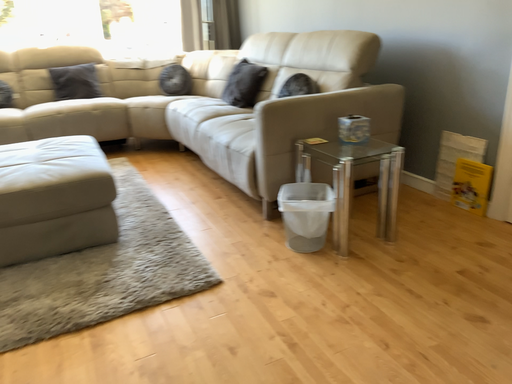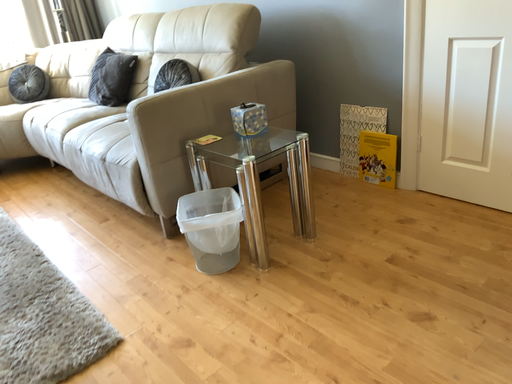
Question: Which way did the camera rotate in the video?

Choices:
 (A) rotated right
 (B) rotated left

Answer: (A)